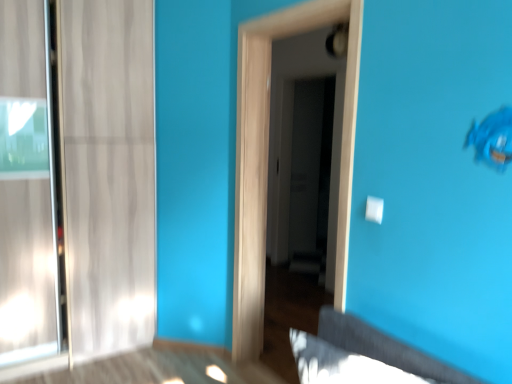
Question: Is point (351, 129) positioned closer to the camera than point (300, 231)?

Choices:
 (A) closer
 (B) farther

Answer: (A)

Question: Would you say transparent glass door at center, the second screen door positioned from the back, is to the left or to the right of transparent glass door at center, positioned as the 2th screen door in front-to-back order, in the picture?

Choices:
 (A) right
 (B) left

Answer: (B)

Question: Is transparent glass door at center, the second screen door positioned from the back, bigger or smaller than transparent glass door at center, positioned as the 2th screen door in front-to-back order?

Choices:
 (A) big
 (B) small

Answer: (A)

Question: Considering their positions, is transparent glass door at center, which is counted as the 1th screen door, starting from the back, located in front of or behind transparent glass door at center, the second screen door positioned from the back?

Choices:
 (A) front
 (B) behind

Answer: (B)

Question: Considering the positions of transparent glass door at center, which is counted as the 1th screen door, starting from the back, and transparent glass door at center, the second screen door positioned from the back, in the image, is transparent glass door at center, which is counted as the 1th screen door, starting from the back, bigger or smaller than transparent glass door at center, the second screen door positioned from the back,?

Choices:
 (A) small
 (B) big

Answer: (A)

Question: From a real-world perspective, is transparent glass door at center, positioned as the 2th screen door in front-to-back order, positioned above or below transparent glass door at center, the second screen door positioned from the back?

Choices:
 (A) above
 (B) below

Answer: (A)

Question: From the image's perspective, relative to transparent glass door at center, which is the 1th screen door from front to back, is transparent glass door at center, which is counted as the 1th screen door, starting from the back, above or below?

Choices:
 (A) above
 (B) below

Answer: (A)